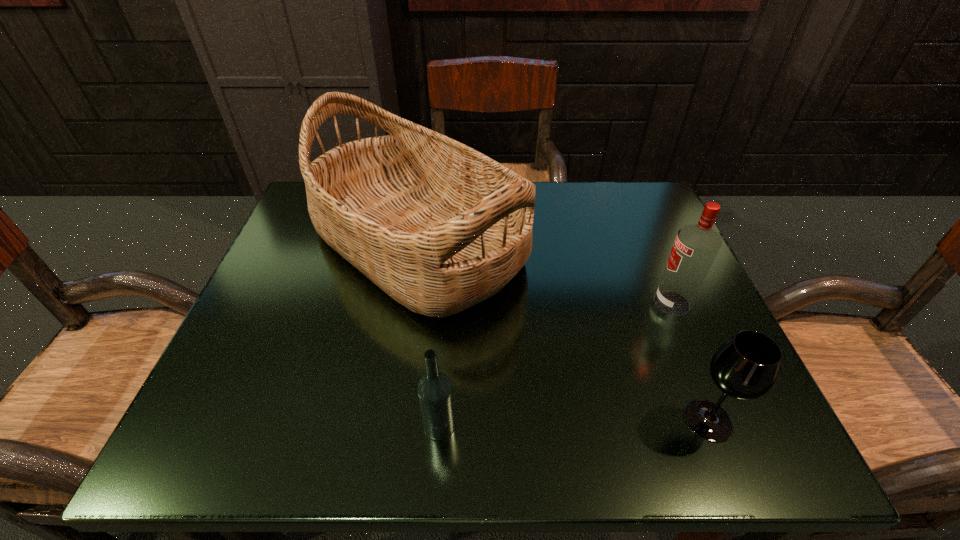
What are the coordinates of `vacant space that satisfies the following two spatial constraints: 1. on the front side of the basket; 2. on the right side of the wineglass` in the screenshot? It's located at (390, 420).